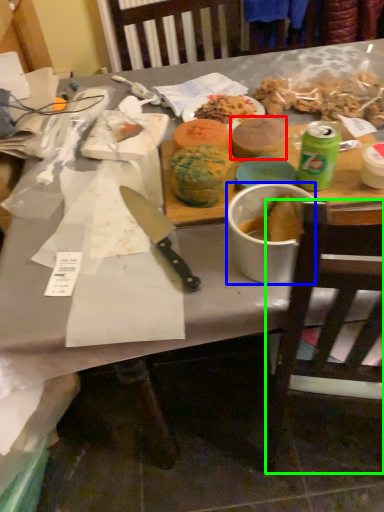
Question: Which is farther away from food (highlighted by a red box)? bowl (highlighted by a blue box) or chair (highlighted by a green box)?

Choices:
 (A) bowl
 (B) chair

Answer: (B)